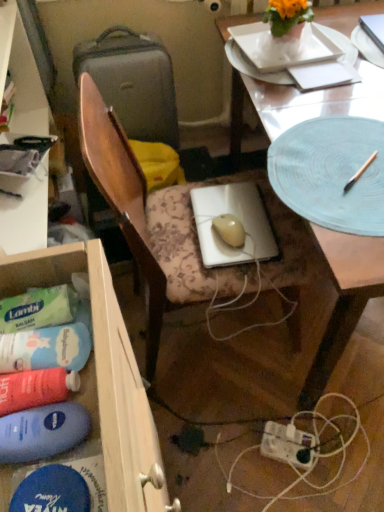
Image resolution: width=384 pixels, height=512 pixels. Find the location of `vacant region to the right of white paper at upper right`. vacant region to the right of white paper at upper right is located at coordinates (369, 67).